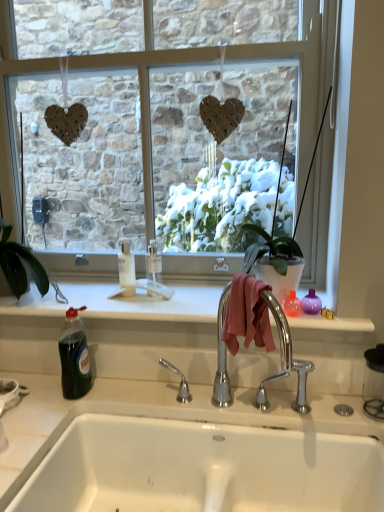
Locate an element on the screen. clear glass window at center is located at coordinates (168, 145).

The width and height of the screenshot is (384, 512). Identify the location of green glossy houseplant at left. (20, 265).

From the image's perspective, is white glossy sink at lower center beneath clear glass window at center?

Yes, from the image's perspective, white glossy sink at lower center is below clear glass window at center.

Considering the sizes of white glossy sink at lower center and clear glass window at center in the image, is white glossy sink at lower center bigger or smaller than clear glass window at center?

white glossy sink at lower center is smaller than clear glass window at center.

Who is smaller, clear glass window at center or green glossy houseplant at left?

green glossy houseplant at left is smaller.

Between point (144, 229) and point (7, 269), which one is positioned behind?

The point (144, 229) is farther.

Find the location of `houseplant on the left of clear glass window at center`. houseplant on the left of clear glass window at center is located at coordinates (20, 265).

Is clear glass window at center looking in the opposite direction of green glossy houseplant at left?

No, green glossy houseplant at left is not at the back of clear glass window at center.

How different are the orientations of clear glass window at center and green translucent bottle at lower left in degrees?

There is a 3.6-degree angle between the facing directions of clear glass window at center and green translucent bottle at lower left.

Which is closer to the camera, (152, 230) or (66, 312)?

The point (66, 312) is closer to the camera.

Image resolution: width=384 pixels, height=512 pixels. I want to click on window lying on the right of green translucent bottle at lower left, so click(x=168, y=145).

Which of these two, clear glass window at center or green translucent bottle at lower left, is smaller?

green translucent bottle at lower left.

Is green glossy houseplant at left next to clear glass window at center and touching it?

No, green glossy houseplant at left is not with clear glass window at center.

Choose the correct answer: Is green glossy houseplant at left inside clear glass window at center or outside it?

green glossy houseplant at left is outside clear glass window at center.

Does green glossy houseplant at left have a smaller size compared to clear glass window at center?

Yes.

Are green translucent bottle at lower left and green glossy houseplant at left beside each other?

No, green translucent bottle at lower left is not next to green glossy houseplant at left.

Which is behind, green translucent bottle at lower left or green glossy houseplant at left?

green glossy houseplant at left is further from the camera.

Where is `houseplant behind the green translucent bottle at lower left`? houseplant behind the green translucent bottle at lower left is located at coordinates (20, 265).

Considering the points (90, 369) and (9, 269), which point is in front, point (90, 369) or point (9, 269)?

The point (90, 369) is in front.

Does point (6, 255) appear closer or farther from the camera than point (81, 308)?

Point (6, 255) is positioned farther from the camera compared to point (81, 308).

Is green glossy houseplant at left taller or shorter than green translucent bottle at lower left?

In the image, green glossy houseplant at left appears to be shorter than green translucent bottle at lower left.

Can you confirm if green glossy houseplant at left is bigger than green translucent bottle at lower left?

Indeed, green glossy houseplant at left has a larger size compared to green translucent bottle at lower left.

Would you say green glossy houseplant at left is to the left or to the right of green translucent bottle at lower left in the picture?

green glossy houseplant at left is to the left of green translucent bottle at lower left.

From the image's perspective, between clear glass window at center and white glossy sink at lower center, who is located below?

white glossy sink at lower center.

Is clear glass window at center spatially inside white glossy sink at lower center, or outside of it?

clear glass window at center lies outside white glossy sink at lower center.

Identify the location of window above the white glossy sink at lower center (from a real-world perspective). The width and height of the screenshot is (384, 512). (168, 145).

Image resolution: width=384 pixels, height=512 pixels. Identify the location of houseplant below the clear glass window at center (from a real-world perspective). (20, 265).

When comparing their distances from clear glass window at center, does white glossy sink at lower center or green translucent bottle at lower left seem further?

white glossy sink at lower center is positioned further to the anchor clear glass window at center.

Based on their spatial positions, is white glossy sink at lower center or clear glass window at center further from green glossy houseplant at left?

white glossy sink at lower center.

Looking at the image, which one is located further to green translucent bottle at lower left, green glossy houseplant at left or white glossy sink at lower center?

Based on the image, white glossy sink at lower center appears to be further to green translucent bottle at lower left.

When comparing their distances from white glossy sink at lower center, does green translucent bottle at lower left or green glossy houseplant at left seem closer?

green translucent bottle at lower left.

Looking at the image, which one is located closer to green glossy houseplant at left, white glossy sink at lower center or green translucent bottle at lower left?

green translucent bottle at lower left lies closer to green glossy houseplant at left than the other object.

Which object lies nearer to the anchor point green glossy houseplant at left, clear glass window at center or white glossy sink at lower center?

clear glass window at center lies closer to green glossy houseplant at left than the other object.

Considering their positions, is green translucent bottle at lower left positioned further to green glossy houseplant at left than white glossy sink at lower center?

white glossy sink at lower center lies further to green glossy houseplant at left than the other object.

Considering their positions, is clear glass window at center positioned closer to green glossy houseplant at left than green translucent bottle at lower left?

The object closer to green glossy houseplant at left is green translucent bottle at lower left.

Locate an element on the screen. bottle between clear glass window at center and white glossy sink at lower center in the vertical direction is located at coordinates (74, 357).

Where is `bottle between green glossy houseplant at left and white glossy sink at lower center from left to right`? bottle between green glossy houseplant at left and white glossy sink at lower center from left to right is located at coordinates (74, 357).

I want to click on houseplant between clear glass window at center and white glossy sink at lower center in the up-down direction, so click(x=20, y=265).

Identify the location of houseplant between clear glass window at center and green translucent bottle at lower left from top to bottom. The height and width of the screenshot is (512, 384). (20, 265).